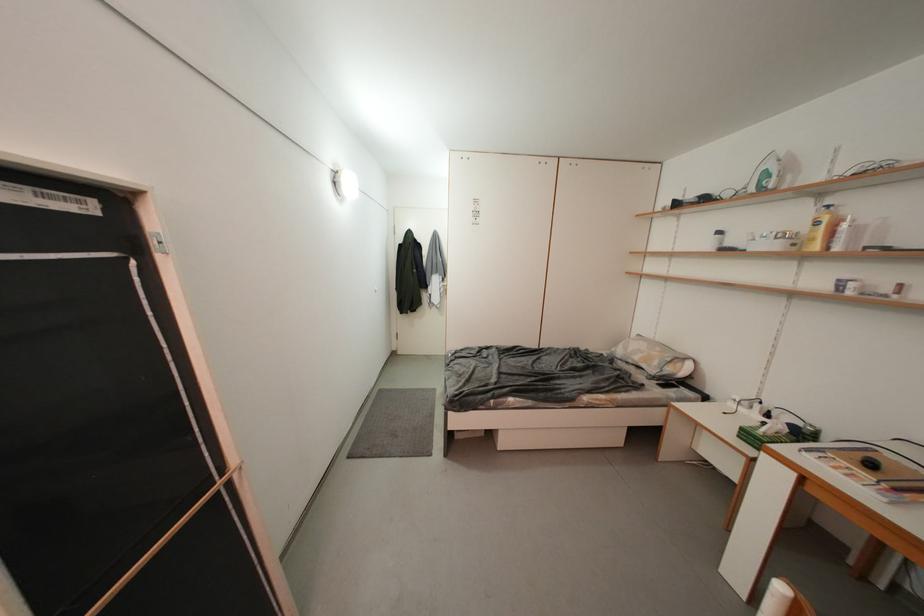
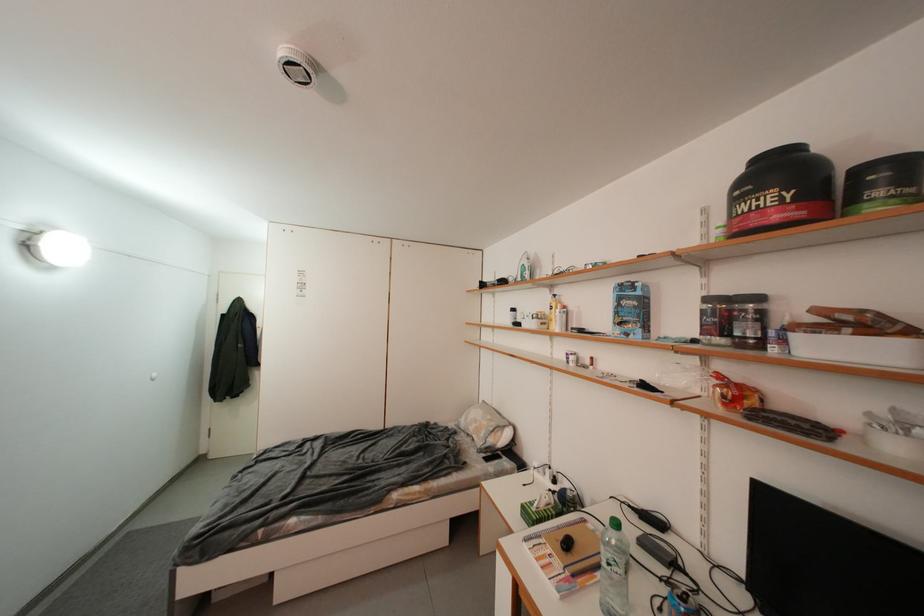
Question: The camera is either moving clockwise (left) or counter-clockwise (right) around the object. The first image is from the beginning of the video and the second image is from the end. Is the camera moving left or right when shooting the video?

Choices:
 (A) Left
 (B) Right

Answer: (A)